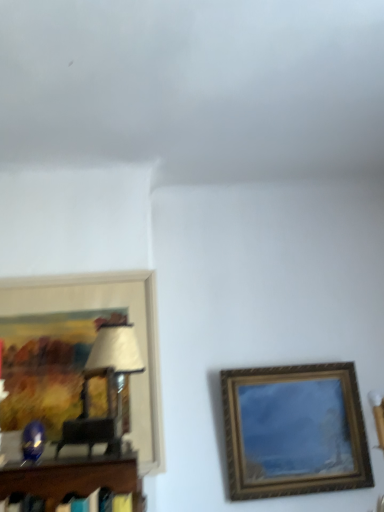
Describe the element at coordinates (101, 316) in the screenshot. This screenshot has width=384, height=512. I see `wooden framed artwork at left, which is counted as the first picture frame, starting from the left` at that location.

In the scene shown: What is the approximate height of wooden framed artwork at left, which is counted as the first picture frame, starting from the left?

21.84 inches.

The image size is (384, 512). What are the coordinates of `wooden framed artwork at left, positioned as the second picture frame in right-to-left order` in the screenshot? It's located at (101, 316).

What do you see at coordinates (294, 430) in the screenshot? The height and width of the screenshot is (512, 384). I see `gold-framed painting at right, the second picture frame from the left` at bounding box center [294, 430].

Where is `gold-framed painting at right, the first picture frame viewed from the right`? The width and height of the screenshot is (384, 512). gold-framed painting at right, the first picture frame viewed from the right is located at coordinates (294, 430).

This screenshot has height=512, width=384. In order to click on wooden framed artwork at left, which is counted as the first picture frame, starting from the left in this screenshot , I will do `click(101, 316)`.

Is gold-framed painting at right, the first picture frame viewed from the right, at the right side of wooden framed artwork at left, which is counted as the first picture frame, starting from the left?

Indeed, gold-framed painting at right, the first picture frame viewed from the right, is positioned on the right side of wooden framed artwork at left, which is counted as the first picture frame, starting from the left.

Is gold-framed painting at right, the first picture frame viewed from the right, further to the viewer compared to wooden framed artwork at left, positioned as the second picture frame in right-to-left order?

Yes.

Which point is more distant from viewer, (x=355, y=416) or (x=29, y=280)?

Positioned behind is point (x=355, y=416).

From the image's perspective, is gold-framed painting at right, the first picture frame viewed from the right, over wooden framed artwork at left, positioned as the second picture frame in right-to-left order?

No.

From a real-world perspective, is gold-framed painting at right, the first picture frame viewed from the right, on top of wooden framed artwork at left, which is counted as the first picture frame, starting from the left?

No, from a real-world perspective, gold-framed painting at right, the first picture frame viewed from the right, is not above wooden framed artwork at left, which is counted as the first picture frame, starting from the left.

Considering the sizes of gold-framed painting at right, the first picture frame viewed from the right, and wooden framed artwork at left, positioned as the second picture frame in right-to-left order, in the image, is gold-framed painting at right, the first picture frame viewed from the right, wider or thinner than wooden framed artwork at left, positioned as the second picture frame in right-to-left order,?

Considering their sizes, gold-framed painting at right, the first picture frame viewed from the right, looks broader than wooden framed artwork at left, positioned as the second picture frame in right-to-left order.

Considering the relative sizes of gold-framed painting at right, the first picture frame viewed from the right, and wooden framed artwork at left, positioned as the second picture frame in right-to-left order, in the image provided, is gold-framed painting at right, the first picture frame viewed from the right, taller than wooden framed artwork at left, positioned as the second picture frame in right-to-left order,?

Incorrect, the height of gold-framed painting at right, the first picture frame viewed from the right, is not larger of that of wooden framed artwork at left, positioned as the second picture frame in right-to-left order.

Does gold-framed painting at right, the first picture frame viewed from the right, have a smaller size compared to wooden framed artwork at left, positioned as the second picture frame in right-to-left order?

Incorrect, gold-framed painting at right, the first picture frame viewed from the right, is not smaller in size than wooden framed artwork at left, positioned as the second picture frame in right-to-left order.

Can we say gold-framed painting at right, the second picture frame from the left, lies outside wooden framed artwork at left, which is counted as the first picture frame, starting from the left?

Yes, gold-framed painting at right, the second picture frame from the left, is located beyond the bounds of wooden framed artwork at left, which is counted as the first picture frame, starting from the left.

Is gold-framed painting at right, the first picture frame viewed from the right, beside wooden framed artwork at left, positioned as the second picture frame in right-to-left order?

gold-framed painting at right, the first picture frame viewed from the right, and wooden framed artwork at left, positioned as the second picture frame in right-to-left order, are clearly separated.

Is gold-framed painting at right, the first picture frame viewed from the right, positioned with its back to wooden framed artwork at left, positioned as the second picture frame in right-to-left order?

No.

How much distance is there between gold-framed painting at right, the second picture frame from the left, and wooden framed artwork at left, which is counted as the first picture frame, starting from the left?

gold-framed painting at right, the second picture frame from the left, and wooden framed artwork at left, which is counted as the first picture frame, starting from the left, are 18.22 inches apart.

Identify the location of picture frame on the left side of gold-framed painting at right, the second picture frame from the left. (101, 316).

Does wooden framed artwork at left, which is counted as the first picture frame, starting from the left, appear on the left side of gold-framed painting at right, the first picture frame viewed from the right?

Yes, wooden framed artwork at left, which is counted as the first picture frame, starting from the left, is to the left of gold-framed painting at right, the first picture frame viewed from the right.

Which is in front, wooden framed artwork at left, positioned as the second picture frame in right-to-left order, or gold-framed painting at right, the first picture frame viewed from the right?

wooden framed artwork at left, positioned as the second picture frame in right-to-left order, is more forward.

Is point (151, 291) positioned in front of point (371, 479)?

No, it is not.

From the image's perspective, would you say wooden framed artwork at left, positioned as the second picture frame in right-to-left order, is shown under gold-framed painting at right, the second picture frame from the left?

Actually, wooden framed artwork at left, positioned as the second picture frame in right-to-left order, appears above gold-framed painting at right, the second picture frame from the left, in the image.

From a real-world perspective, between wooden framed artwork at left, positioned as the second picture frame in right-to-left order, and gold-framed painting at right, the second picture frame from the left, who is vertically lower?

gold-framed painting at right, the second picture frame from the left.

Considering the relative sizes of wooden framed artwork at left, which is counted as the first picture frame, starting from the left, and gold-framed painting at right, the first picture frame viewed from the right, in the image provided, is wooden framed artwork at left, which is counted as the first picture frame, starting from the left, wider than gold-framed painting at right, the first picture frame viewed from the right,?

No.

Consider the image. Considering the sizes of objects wooden framed artwork at left, positioned as the second picture frame in right-to-left order, and gold-framed painting at right, the first picture frame viewed from the right, in the image provided, who is taller, wooden framed artwork at left, positioned as the second picture frame in right-to-left order, or gold-framed painting at right, the first picture frame viewed from the right,?

With more height is wooden framed artwork at left, positioned as the second picture frame in right-to-left order.

Can you confirm if wooden framed artwork at left, positioned as the second picture frame in right-to-left order, is bigger than gold-framed painting at right, the second picture frame from the left?

No, wooden framed artwork at left, positioned as the second picture frame in right-to-left order, is not bigger than gold-framed painting at right, the second picture frame from the left.

Which is correct: wooden framed artwork at left, positioned as the second picture frame in right-to-left order, is inside gold-framed painting at right, the first picture frame viewed from the right, or outside of it?

wooden framed artwork at left, positioned as the second picture frame in right-to-left order, exists outside the volume of gold-framed painting at right, the first picture frame viewed from the right.

Does wooden framed artwork at left, which is counted as the first picture frame, starting from the left, touch gold-framed painting at right, the second picture frame from the left?

No.

Is wooden framed artwork at left, which is counted as the first picture frame, starting from the left, aimed at gold-framed painting at right, the second picture frame from the left?

No.

Based on the photo, how many degrees apart are the facing directions of wooden framed artwork at left, positioned as the second picture frame in right-to-left order, and gold-framed painting at right, the second picture frame from the left?

The facing directions of wooden framed artwork at left, positioned as the second picture frame in right-to-left order, and gold-framed painting at right, the second picture frame from the left, are 0.688 degrees apart.

Could you measure the distance between wooden framed artwork at left, which is counted as the first picture frame, starting from the left, and gold-framed painting at right, the first picture frame viewed from the right?

wooden framed artwork at left, which is counted as the first picture frame, starting from the left, and gold-framed painting at right, the first picture frame viewed from the right, are 18.22 inches apart.

Where is `picture frame behind the wooden framed artwork at left, positioned as the second picture frame in right-to-left order`? The image size is (384, 512). picture frame behind the wooden framed artwork at left, positioned as the second picture frame in right-to-left order is located at coordinates (294, 430).

Where is `picture frame behind the wooden framed artwork at left, positioned as the second picture frame in right-to-left order`? The image size is (384, 512). picture frame behind the wooden framed artwork at left, positioned as the second picture frame in right-to-left order is located at coordinates (294, 430).

Locate an element on the screen. The height and width of the screenshot is (512, 384). picture frame that is above the gold-framed painting at right, the second picture frame from the left (from a real-world perspective) is located at coordinates (101, 316).